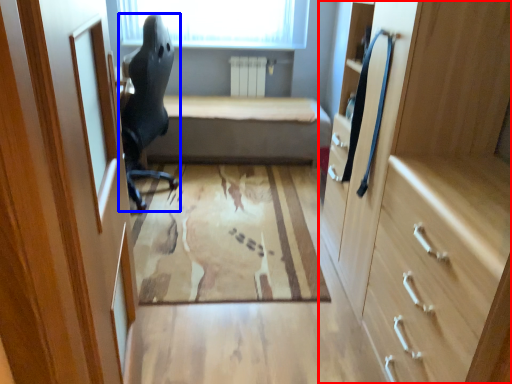
Question: Which object is closer to the camera taking this photo, cabinetry (highlighted by a red box) or chair (highlighted by a blue box)?

Choices:
 (A) cabinetry
 (B) chair

Answer: (A)